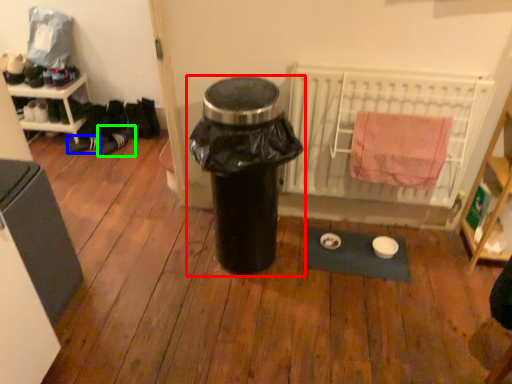
Question: Which object is the farthest from waste container (highlighted by a red box)? Choose among these: shoe (highlighted by a blue box) or shoe (highlighted by a green box).

Choices:
 (A) shoe
 (B) shoe

Answer: (A)